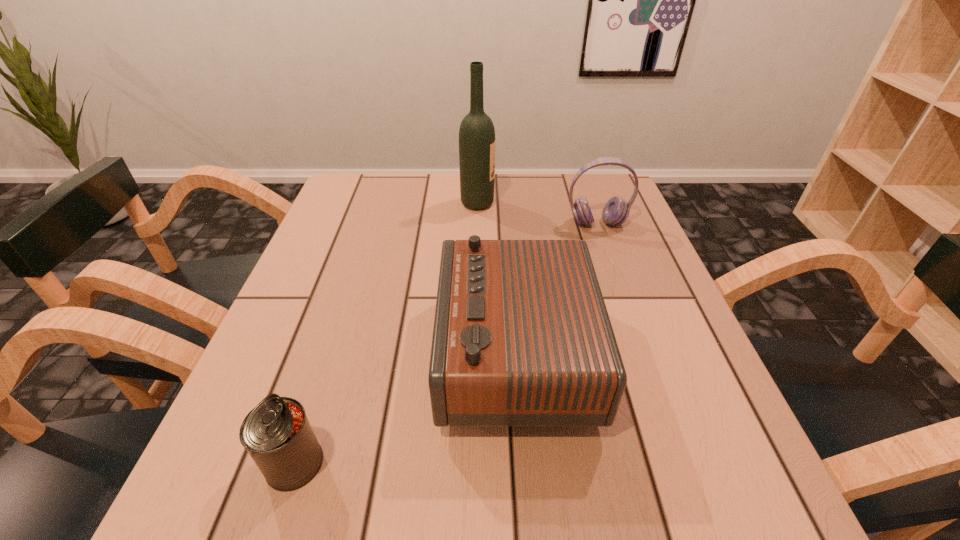
You are a GUI agent. You are given a task and a screenshot of the screen. Output one action in this format:
    pyautogui.click(x=<x>, y=<y>)
    Task: Click on the free area in between the leftmost object and the farthest object
    The height and width of the screenshot is (540, 960).
    Given the screenshot: What is the action you would take?
    pyautogui.click(x=386, y=333)

The image size is (960, 540). I want to click on free spot between the farthest object and the second farthest object, so click(x=538, y=213).

I want to click on object that ranks as the second closest to the second farthest object, so click(x=522, y=338).

Locate which object is the third closest to the shortest object. Please provide its 2D coordinates. Your answer should be formatted as a tuple, i.e. [(x, y)], where the tuple contains the x and y coordinates of a point satisfying the conditions above.

[(615, 212)]

Where is `free space that satisfies the following two spatial constraints: 1. on the labeled side of the tallest object; 2. on the front side of the leftmost object`? This screenshot has height=540, width=960. free space that satisfies the following two spatial constraints: 1. on the labeled side of the tallest object; 2. on the front side of the leftmost object is located at coordinates (475, 463).